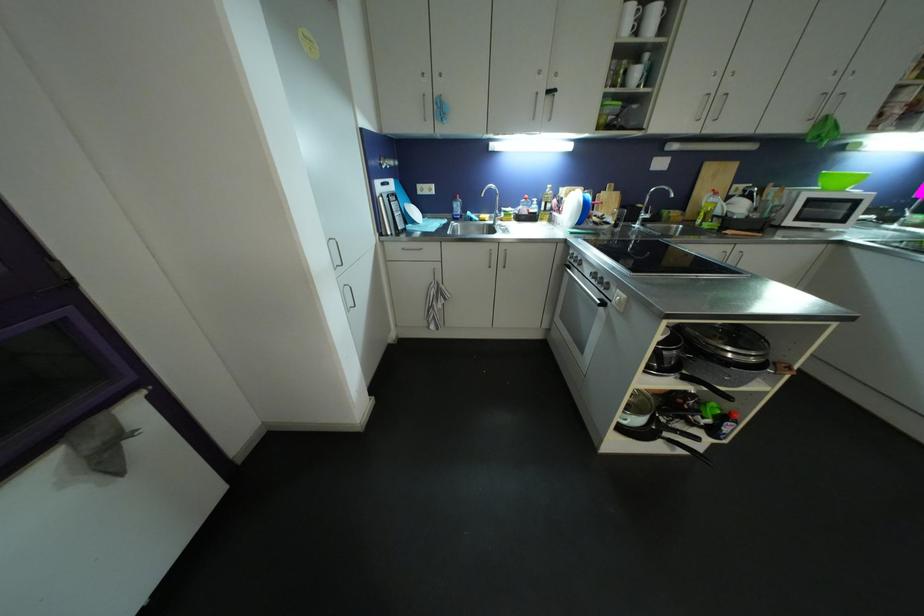
The image size is (924, 616). I want to click on black pan handle, so pyautogui.click(x=675, y=435).